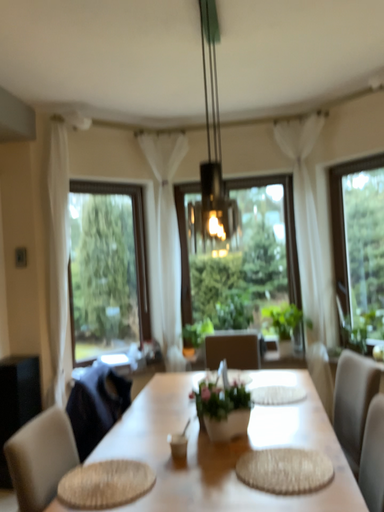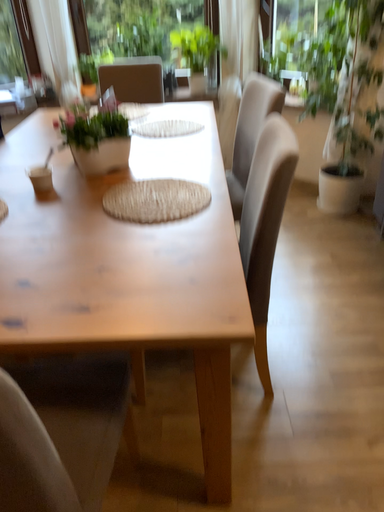
Question: How did the camera likely rotate when shooting the video?

Choices:
 (A) rotated right
 (B) rotated left

Answer: (A)